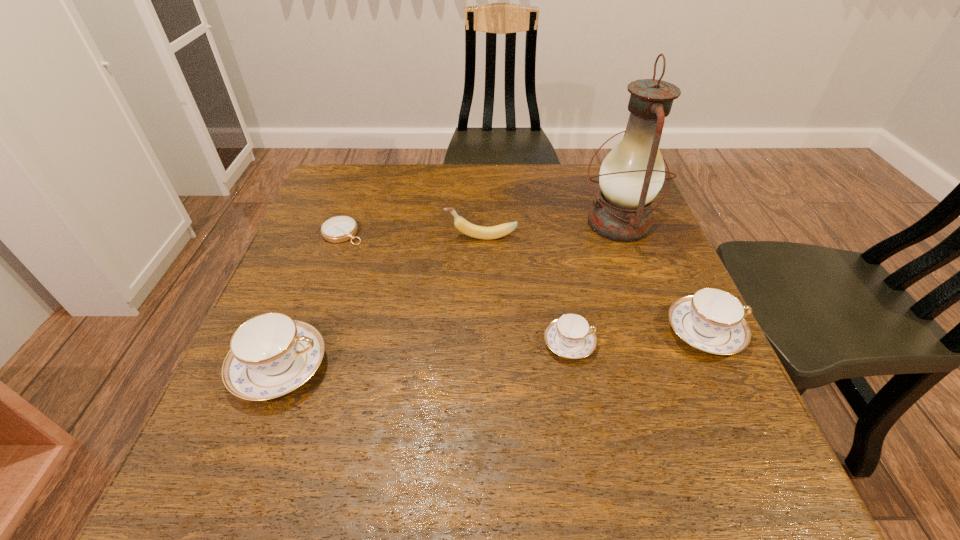
You are a GUI agent. You are given a task and a screenshot of the screen. Output one action in this format:
    pyautogui.click(x=<x>, y=<y>)
    Task: Click on the vacant area situated 0.200m at the stem of the banana
    Image resolution: width=960 pixels, height=540 pixels.
    Given the screenshot: What is the action you would take?
    pyautogui.click(x=364, y=238)

The image size is (960, 540). In order to click on vacant space positioned at the stem of the banana in this screenshot , I will do `click(409, 238)`.

Where is `free region located on the left of the tallest object`? free region located on the left of the tallest object is located at coordinates point(516,223).

This screenshot has width=960, height=540. I want to click on blank area located on the back of the compass, so click(357, 193).

Locate an element on the screen. object that is at the far edge is located at coordinates (631, 175).

The image size is (960, 540). Find the location of `object located at the near edge`. object located at the near edge is located at coordinates (270, 355).

Where is `teacup at the left edge`? teacup at the left edge is located at coordinates (270, 355).

Locate an element on the screen. compass situated at the left edge is located at coordinates (338, 229).

What are the coordinates of `teacup that is at the right edge` in the screenshot? It's located at (712, 320).

At what (x,y) coordinates should I click in order to perform the action: click on oil lamp located at the right edge. Please return your answer as a coordinate pair (x, y). Looking at the image, I should click on (631, 175).